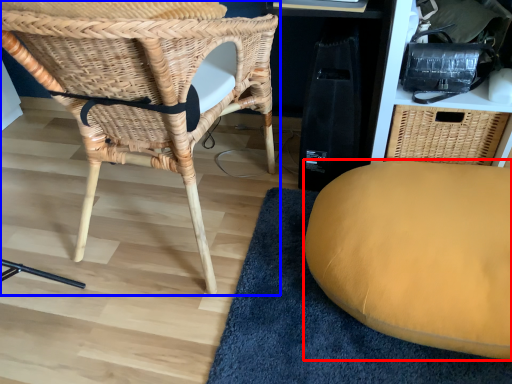
Question: Among these objects, which one is nearest to the camera, furniture (highlighted by a red box) or chair (highlighted by a blue box)?

Choices:
 (A) furniture
 (B) chair

Answer: (B)